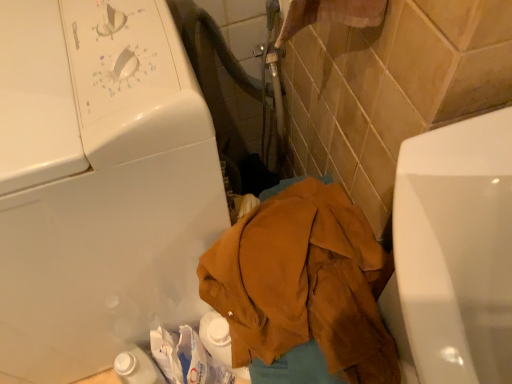
The height and width of the screenshot is (384, 512). Describe the element at coordinates (303, 289) in the screenshot. I see `brown corduroy jacket at center` at that location.

Measure the distance between brown corduroy jacket at center and camera.

24.35 inches.

I want to click on brown corduroy jacket at center, so click(303, 289).

What do you see at coordinates (98, 184) in the screenshot? I see `white glossy washing machine at upper left` at bounding box center [98, 184].

This screenshot has width=512, height=384. Identify the location of white glossy washing machine at upper left. click(x=98, y=184).

Where is `brown corduroy jacket at center`? The image size is (512, 384). brown corduroy jacket at center is located at coordinates 303,289.

Does white glossy washing machine at upper left appear on the left side of brown corduroy jacket at center?

Yes.

Is white glossy washing machine at upper left closer to the viewer compared to brown corduroy jacket at center?

Yes, white glossy washing machine at upper left is closer to the viewer.

Is point (136, 56) positioned behind point (315, 259)?

No, it is not.

From the image's perspective, is white glossy washing machine at upper left over brown corduroy jacket at center?

Yes, from the image's perspective, white glossy washing machine at upper left is on top of brown corduroy jacket at center.

From a real-world perspective, who is located lower, white glossy washing machine at upper left or brown corduroy jacket at center?

brown corduroy jacket at center.

Does white glossy washing machine at upper left have a greater width compared to brown corduroy jacket at center?

Result: Indeed, white glossy washing machine at upper left has a greater width compared to brown corduroy jacket at center.

Between white glossy washing machine at upper left and brown corduroy jacket at center, which one has more height?

With more height is white glossy washing machine at upper left.

Which of these two, white glossy washing machine at upper left or brown corduroy jacket at center, is bigger?

white glossy washing machine at upper left.

From the picture: Would you say white glossy washing machine at upper left is outside brown corduroy jacket at center?

Yes, white glossy washing machine at upper left is located beyond the bounds of brown corduroy jacket at center.

Are white glossy washing machine at upper left and brown corduroy jacket at center making contact?

white glossy washing machine at upper left and brown corduroy jacket at center are not in contact.

Is white glossy washing machine at upper left oriented away from brown corduroy jacket at center?

No, white glossy washing machine at upper left is not facing away from brown corduroy jacket at center.

Can you tell me how much white glossy washing machine at upper left and brown corduroy jacket at center differ in facing direction?

The angular difference between white glossy washing machine at upper left and brown corduroy jacket at center is 0.000251 degrees.

Locate an element on the screen. clothing located on the right of white glossy washing machine at upper left is located at coordinates (303, 289).

Based on their positions, is brown corduroy jacket at center located to the left or right of white glossy washing machine at upper left?

Based on their positions, brown corduroy jacket at center is located to the right of white glossy washing machine at upper left.

Between brown corduroy jacket at center and white glossy washing machine at upper left, which one is positioned in front?

white glossy washing machine at upper left is in front.

Is point (330, 199) positioned behind point (4, 144)?

Yes, it is behind point (4, 144).

From the image's perspective, would you say brown corduroy jacket at center is shown under white glossy washing machine at upper left?

Yes, from the image's perspective, brown corduroy jacket at center is beneath white glossy washing machine at upper left.

From a real-world perspective, is brown corduroy jacket at center located beneath white glossy washing machine at upper left?

Correct, in the physical world, brown corduroy jacket at center is lower than white glossy washing machine at upper left.

Which of these two, brown corduroy jacket at center or white glossy washing machine at upper left, is thinner?

brown corduroy jacket at center is thinner.

From their relative heights in the image, would you say brown corduroy jacket at center is taller or shorter than white glossy washing machine at upper left?

brown corduroy jacket at center is shorter than white glossy washing machine at upper left.

From the picture: Between brown corduroy jacket at center and white glossy washing machine at upper left, which one has larger size?

white glossy washing machine at upper left is bigger.

Would you say brown corduroy jacket at center is outside white glossy washing machine at upper left?

Actually, brown corduroy jacket at center is at least partially inside white glossy washing machine at upper left.

Is brown corduroy jacket at center touching white glossy washing machine at upper left?

There is a gap between brown corduroy jacket at center and white glossy washing machine at upper left.

Does brown corduroy jacket at center turn towards white glossy washing machine at upper left?

No, brown corduroy jacket at center is not facing towards white glossy washing machine at upper left.

I want to click on washing machine in front of the brown corduroy jacket at center, so click(x=98, y=184).

Locate an element on the screen. This screenshot has width=512, height=384. clothing on the right of white glossy washing machine at upper left is located at coordinates (303, 289).

In order to click on clothing below the white glossy washing machine at upper left (from the image's perspective) in this screenshot , I will do `click(303, 289)`.